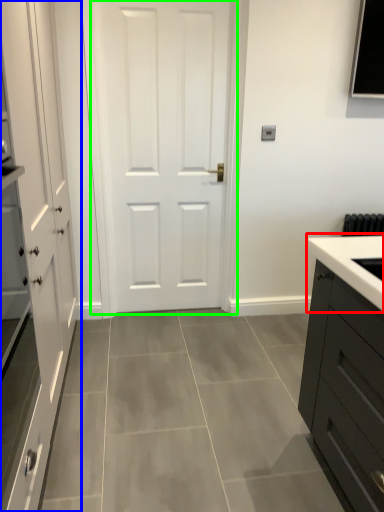
Question: Based on their relative distances, which object is farther from sink (highlighted by a red box)? Choose from cabinetry (highlighted by a blue box) and door (highlighted by a green box).

Choices:
 (A) cabinetry
 (B) door

Answer: (B)